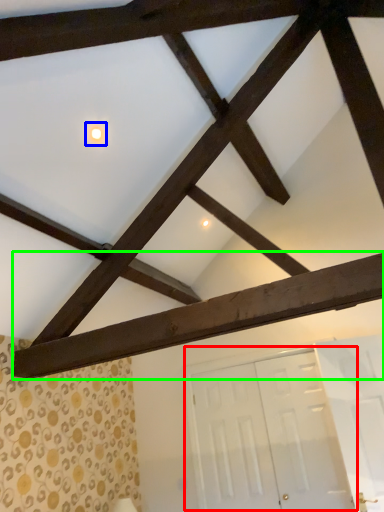
Question: Considering the real-world distances, which object is farthest from door (highlighted by a red box)? light (highlighted by a blue box) or plank (highlighted by a green box)?

Choices:
 (A) light
 (B) plank

Answer: (A)